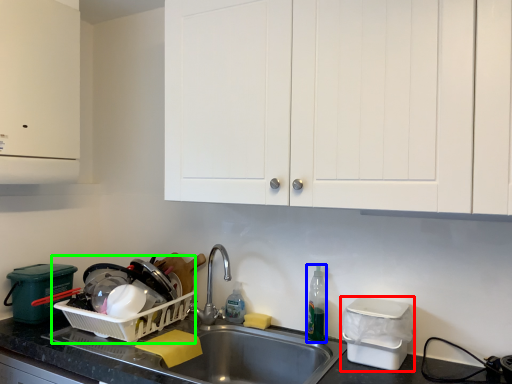
Question: Which is farther away from appliance (highlighted by a red box)? bottle (highlighted by a blue box) or appliance (highlighted by a green box)?

Choices:
 (A) bottle
 (B) appliance

Answer: (B)